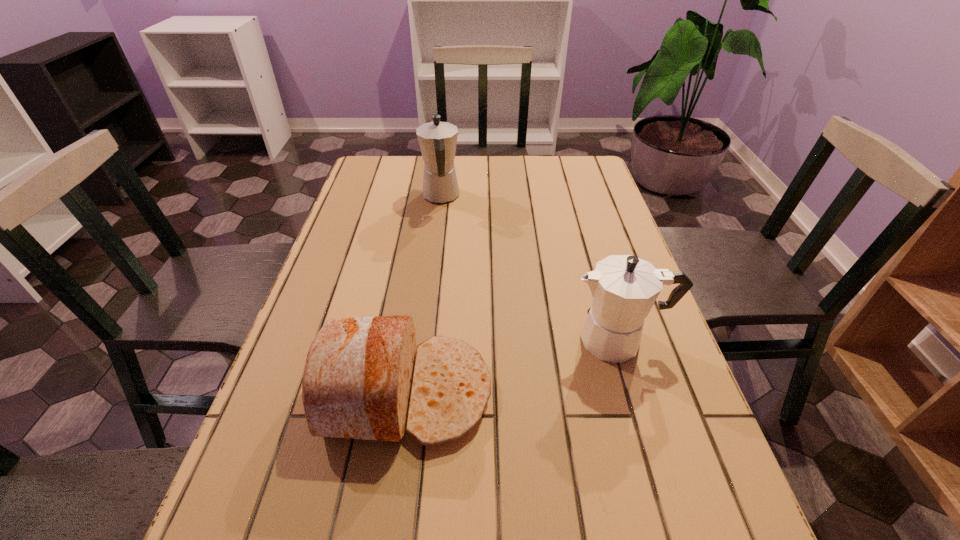
The width and height of the screenshot is (960, 540). Identify the location of the farthest object. (437, 140).

The image size is (960, 540). Identify the location of the left coffeepot. (437, 140).

Image resolution: width=960 pixels, height=540 pixels. What are the coordinates of `the right coffeepot` in the screenshot? It's located at (624, 288).

Locate an element on the screen. the rightmost object is located at coordinates (624, 288).

Locate an element on the screen. bread is located at coordinates (357, 379).

The height and width of the screenshot is (540, 960). What are the coordinates of `vacant space located on the front of the left coffeepot` in the screenshot? It's located at (438, 224).

The height and width of the screenshot is (540, 960). In order to click on vacant area situated at the spout of the rightmost object in this screenshot , I will do `click(494, 340)`.

You are a GUI agent. You are given a task and a screenshot of the screen. Output one action in this format:
    pyautogui.click(x=<x>, y=<y>)
    Task: Click on the vacant area situated 0.130m at the spout of the rightmost object
    The height and width of the screenshot is (540, 960).
    Given the screenshot: What is the action you would take?
    pyautogui.click(x=509, y=340)

Where is `free space located at the spout of the rightmost object`? free space located at the spout of the rightmost object is located at coordinates point(499,340).

You are a GUI agent. You are given a task and a screenshot of the screen. Output one action in this format:
    pyautogui.click(x=<x>, y=<y>)
    Task: Click on the blank space located 0.200m at the sliced end of the shortest object
    The height and width of the screenshot is (540, 960).
    Given the screenshot: What is the action you would take?
    pyautogui.click(x=594, y=392)